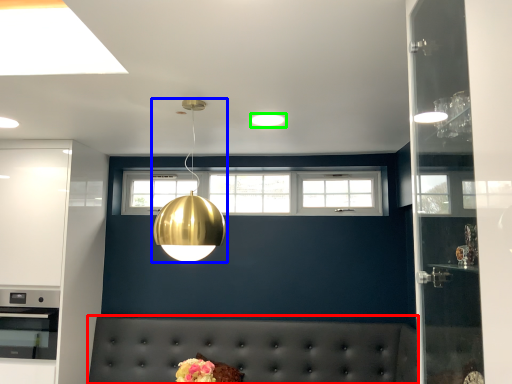
Question: Based on their relative distances, which object is nearer to couch (highlighted by a red box)? Choose from lamp (highlighted by a blue box) and lighting (highlighted by a green box).

Choices:
 (A) lamp
 (B) lighting

Answer: (A)